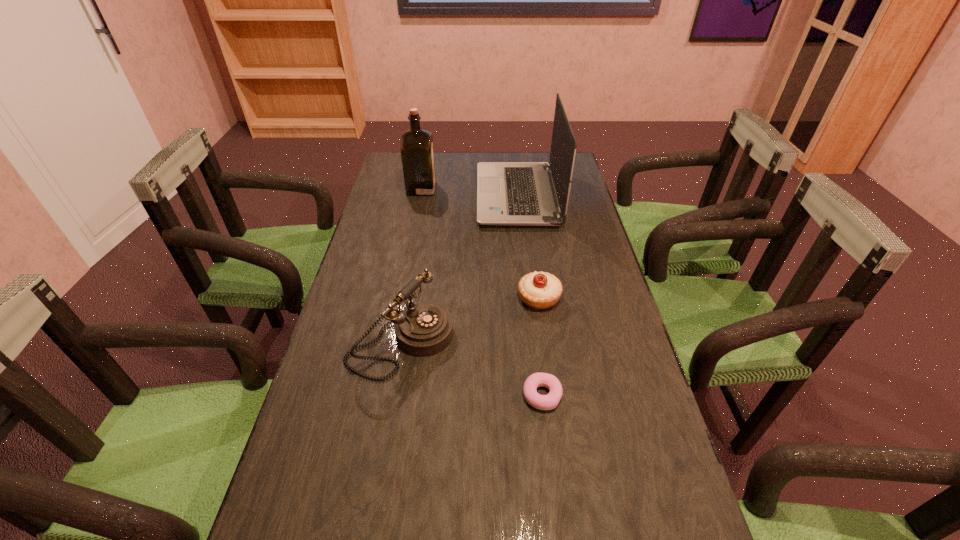
Where is `blank area in the image that satisfies the following two spatial constraints: 1. on the label of the liquor; 2. on the left side of the telephone`? The image size is (960, 540). blank area in the image that satisfies the following two spatial constraints: 1. on the label of the liquor; 2. on the left side of the telephone is located at coordinates (393, 342).

This screenshot has height=540, width=960. I want to click on vacant space that satisfies the following two spatial constraints: 1. on the back side of the fourth tallest object; 2. on the label of the liquor, so click(523, 188).

The height and width of the screenshot is (540, 960). Identify the location of vacant space that satisfies the following two spatial constraints: 1. on the screen of the laptop computer; 2. on the left side of the second shortest object. (529, 298).

You are a GUI agent. You are given a task and a screenshot of the screen. Output one action in this format:
    pyautogui.click(x=<x>, y=<y>)
    Task: Click on the free space that satisfies the following two spatial constraints: 1. on the back side of the second shortest object; 2. on the right side of the shorter pastry
    Image resolution: width=960 pixels, height=540 pixels.
    Given the screenshot: What is the action you would take?
    pyautogui.click(x=530, y=298)

The height and width of the screenshot is (540, 960). Find the location of `free space that satisfies the following two spatial constraints: 1. on the screen of the laptop computer; 2. on the back side of the second shortest object`. free space that satisfies the following two spatial constraints: 1. on the screen of the laptop computer; 2. on the back side of the second shortest object is located at coordinates (529, 298).

The height and width of the screenshot is (540, 960). What are the coordinates of `free region that satisfies the following two spatial constraints: 1. on the screen of the laptop computer; 2. on the right side of the fourth tallest object` in the screenshot? It's located at (529, 298).